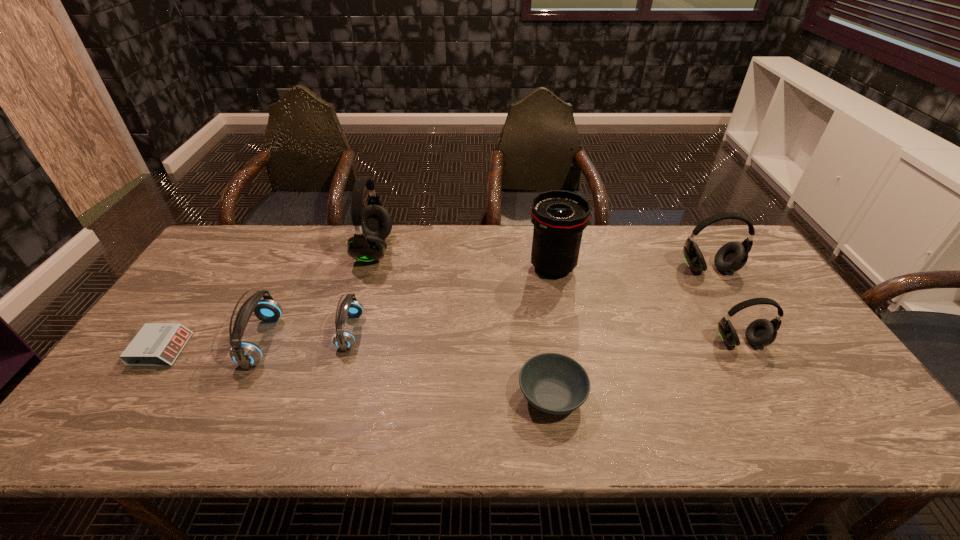
Find the location of a particular element. The image size is (960, 540). free region located 0.290m on the right of the leftmost object is located at coordinates (295, 350).

You are a GUI agent. You are given a task and a screenshot of the screen. Output one action in this format:
    pyautogui.click(x=<x>, y=<y>)
    Task: Click on the telephoto lens that is at the far edge
    The image size is (960, 540).
    Given the screenshot: What is the action you would take?
    pyautogui.click(x=559, y=217)

Image resolution: width=960 pixels, height=540 pixels. In order to click on object that is positioned at the near edge in this screenshot , I will do `click(553, 383)`.

The image size is (960, 540). I want to click on object present at the left edge, so click(x=157, y=344).

Where is `object positioned at the far right corner`? The width and height of the screenshot is (960, 540). object positioned at the far right corner is located at coordinates (731, 257).

Find the location of a particular element. The width and height of the screenshot is (960, 540). vacant space at the far edge is located at coordinates (603, 226).

This screenshot has width=960, height=540. In order to click on free space at the near edge in this screenshot , I will do `click(355, 428)`.

In the image, there is a desktop. Identify the location of free space at the left edge. The height and width of the screenshot is (540, 960). (174, 320).

Locate an element on the screen. vacant area at the far right corner of the desktop is located at coordinates pyautogui.click(x=722, y=234).

Where is `empty location between the telephoto lens and the seventh tallest object`? The height and width of the screenshot is (540, 960). empty location between the telephoto lens and the seventh tallest object is located at coordinates (552, 332).